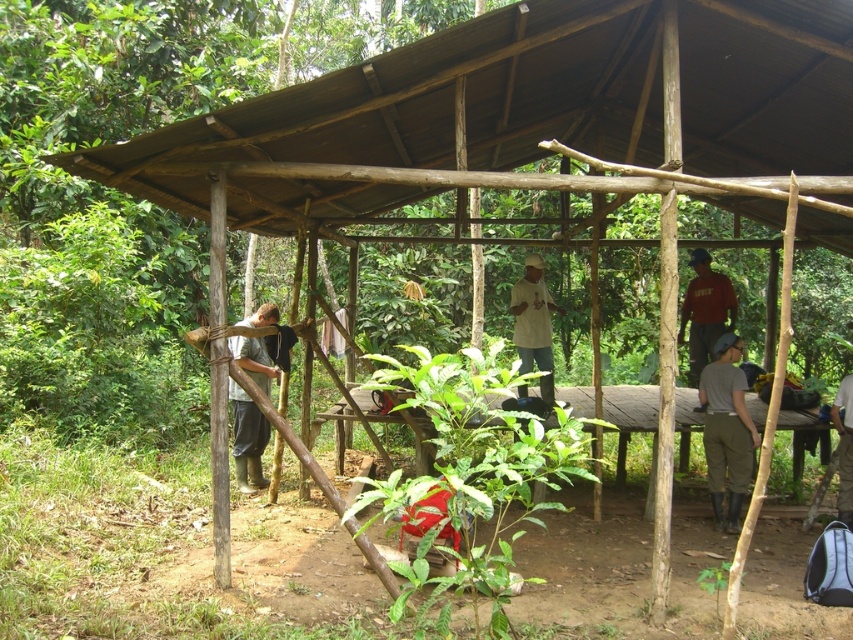
Which is above, gray matte pants at lower right or green matte shirt at left?

Positioned higher is green matte shirt at left.

In order to click on gray matte pants at lower right in this screenshot , I will do `click(726, 429)`.

Which is below, green matte shirt at left or dark red shirt at center?

green matte shirt at left is below.

Which is above, green matte shirt at left or dark red shirt at center?

dark red shirt at center

Which is behind, point (253, 358) or point (686, 321)?

The point (686, 321) is behind.

Identify the location of green matte shirt at left. The height and width of the screenshot is (640, 853). (247, 440).

Who is shorter, gray matte pants at lower right or dark gray fabric bag at center?

dark gray fabric bag at center

Is gray matte pants at lower right below dark gray fabric bag at center?

Actually, gray matte pants at lower right is above dark gray fabric bag at center.

Image resolution: width=853 pixels, height=640 pixels. Describe the element at coordinates (726, 429) in the screenshot. I see `gray matte pants at lower right` at that location.

Find the location of a particular element. The height and width of the screenshot is (640, 853). gray matte pants at lower right is located at coordinates (726, 429).